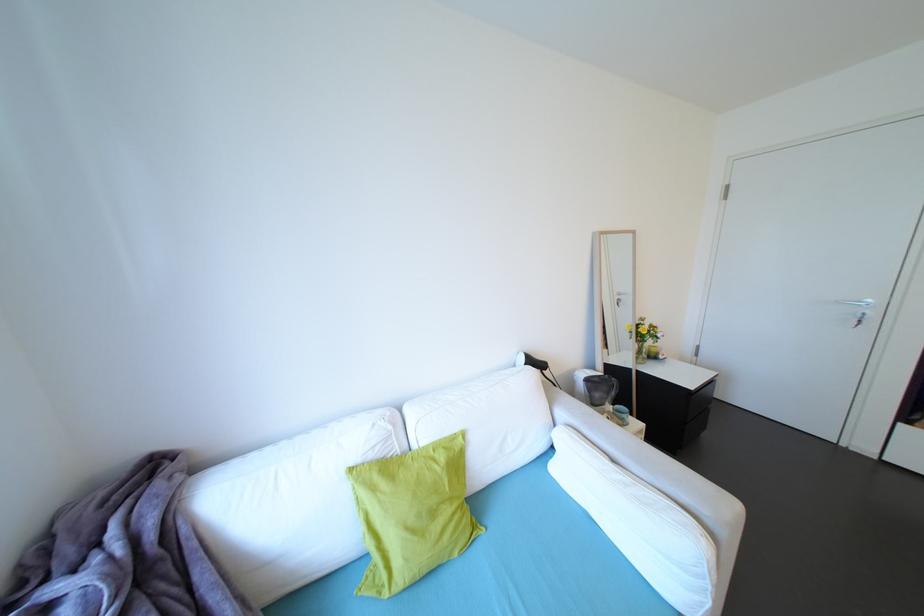
The width and height of the screenshot is (924, 616). What do you see at coordinates (662, 476) in the screenshot?
I see `the sofa armrest` at bounding box center [662, 476].